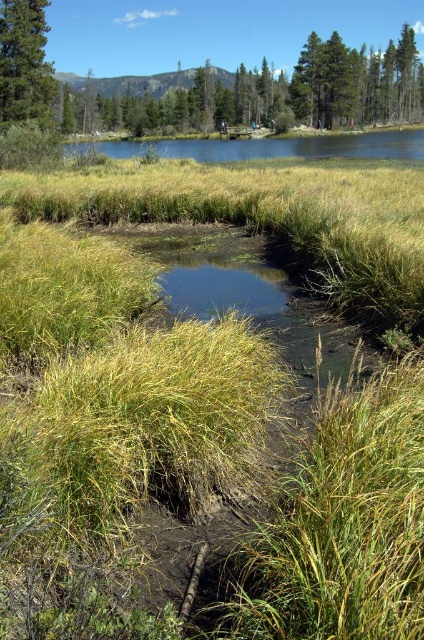
Question: Is green leafy tree at upper center positioned in front of green matte tree at upper left?

Choices:
 (A) yes
 (B) no

Answer: (B)

Question: Considering the relative positions of green leafy tree at upper center and green matte tree at upper left in the image provided, where is green leafy tree at upper center located with respect to green matte tree at upper left?

Choices:
 (A) right
 (B) left

Answer: (A)

Question: Which point appears closest to the camera in this image?

Choices:
 (A) (19, 65)
 (B) (116, 96)

Answer: (A)

Question: Can you confirm if green leafy tree at upper center is positioned below green matte tree at upper left?

Choices:
 (A) no
 (B) yes

Answer: (A)

Question: Which point is farther to the camera?

Choices:
 (A) (407, 76)
 (B) (38, 22)

Answer: (A)

Question: Among these objects, which one is nearest to the camera?

Choices:
 (A) green leafy tree at upper center
 (B) green matte tree at upper left

Answer: (B)